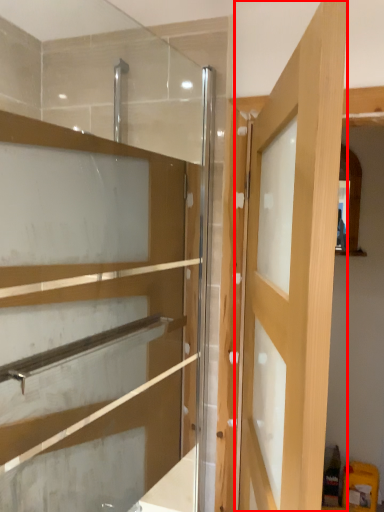
Question: Observing the image, what is the correct spatial positioning of door (annotated by the red box) in reference to cabinetry?

Choices:
 (A) left
 (B) right

Answer: (B)